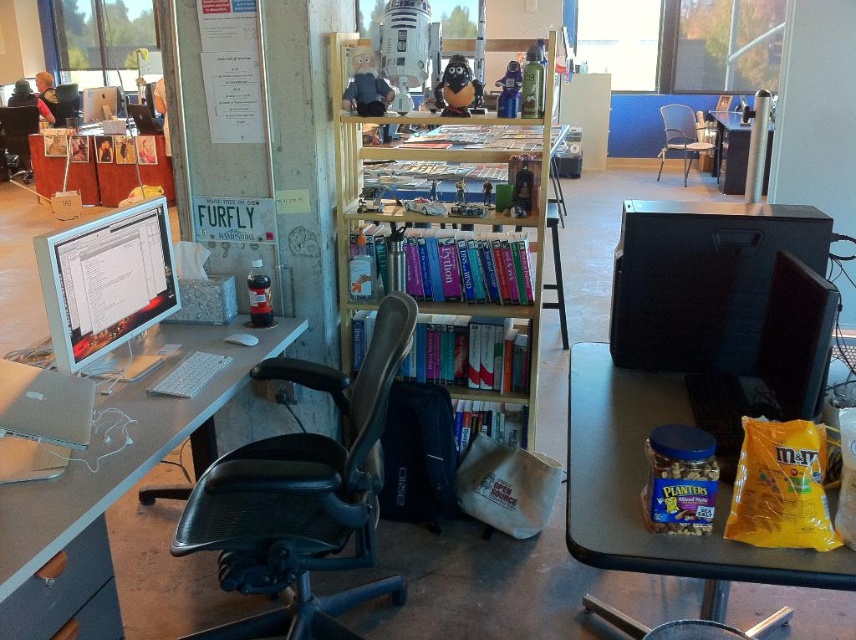
Question: From the image, what is the correct spatial relationship of wooden bookshelf at center in relation to satin silver monitor at left?

Choices:
 (A) above
 (B) below

Answer: (A)

Question: Which object is positioned farthest from the matte plastic computer desk at right?

Choices:
 (A) metallic silver chair at center
 (B) wooden bookshelf at center

Answer: (A)

Question: Is the position of white plastic computer desk at left more distant than that of metallic silver chair at center?

Choices:
 (A) yes
 (B) no

Answer: (B)

Question: Among these objects, which one is nearest to the camera?

Choices:
 (A) satin silver monitor at left
 (B) metallic silver chair at center

Answer: (A)

Question: Which object is positioned closest to the matte plastic computer desk at right?

Choices:
 (A) metallic silver chair at center
 (B) white paperboard at upper left
 (C) black leather swivel chair at center

Answer: (C)

Question: Does wooden bookshelf at center appear under metallic silver chair at center?

Choices:
 (A) no
 (B) yes

Answer: (B)